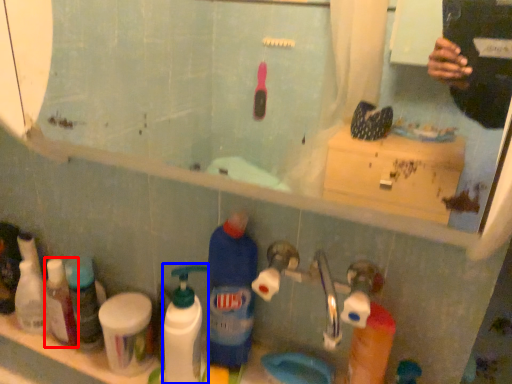
Question: Which of the following is the closest to the observer, toiletry (highlighted by a red box) or cleaning product (highlighted by a blue box)?

Choices:
 (A) toiletry
 (B) cleaning product

Answer: (B)